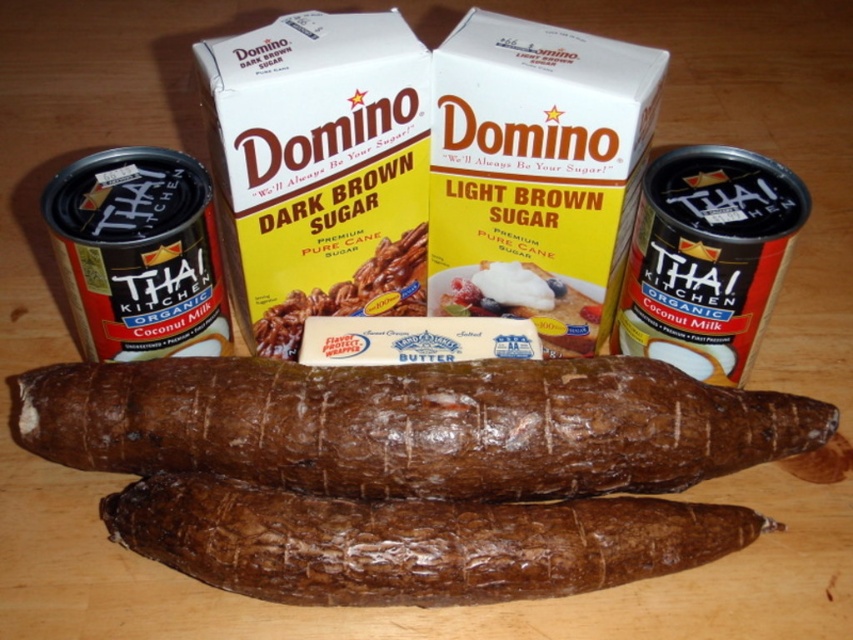
You are a chef preparing a recipe that requires both the brown rough textured yam at center and the buttery smooth butter at center. You need to place them on a shelf in the pantry. Which object should you place first if you want to stack them vertically?

The brown rough textured yam at center should be placed first at the bottom because it is below the buttery smooth butter at center in the image, indicating it is larger or more stable for stacking.

You are preparing a recipe that requires selecting the largest yam available. Based on the image, which yam should you choose between the brown rough textured yam at center and the brown rough textured yams at bottom?

The brown rough textured yam at center is larger in size compared to the brown rough textured yams at bottom, so you should choose the brown rough textured yam at center.

You are a chef preparing a recipe that requires both the brown rough textured yam at center and dark brown sugar at center. The recipe specifies that the distance between them must be exactly 12 inches to ensure proper mixing. Can you confirm if the current arrangement meets this requirement?

The brown rough textured yam at center and dark brown sugar at center are 11.29 inches apart from each other, which is slightly less than the required 12 inches. Therefore, the current arrangement does not meet the requirement.